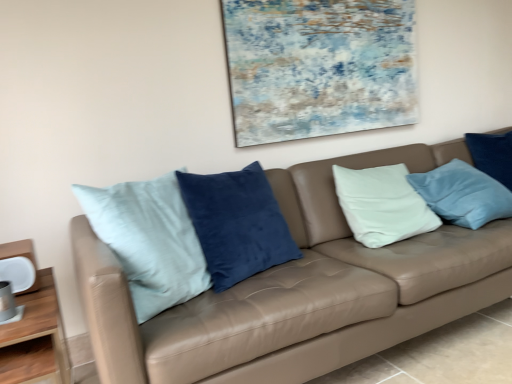
Question: From a real-world perspective, is velvet blue pillow at right located beneath leather couch at center?

Choices:
 (A) yes
 (B) no

Answer: (B)

Question: Considering the relative sizes of velvet blue pillow at right and leather couch at center in the image provided, is velvet blue pillow at right taller than leather couch at center?

Choices:
 (A) yes
 (B) no

Answer: (B)

Question: Is velvet blue pillow at right with leather couch at center?

Choices:
 (A) no
 (B) yes

Answer: (A)

Question: Can you confirm if velvet blue pillow at right is smaller than leather couch at center?

Choices:
 (A) no
 (B) yes

Answer: (B)

Question: Would you say velvet blue pillow at right is outside leather couch at center?

Choices:
 (A) yes
 (B) no

Answer: (B)

Question: Is velvet blue pillow at right looking in the opposite direction of leather couch at center?

Choices:
 (A) yes
 (B) no

Answer: (A)

Question: From a real-world perspective, is leather couch at center positioned under textured canvas painting at upper center based on gravity?

Choices:
 (A) no
 (B) yes

Answer: (B)

Question: Does leather couch at center have a lesser width compared to textured canvas painting at upper center?

Choices:
 (A) no
 (B) yes

Answer: (A)

Question: Is leather couch at center facing away from textured canvas painting at upper center?

Choices:
 (A) yes
 (B) no

Answer: (B)

Question: Is leather couch at center closer to camera compared to textured canvas painting at upper center?

Choices:
 (A) yes
 (B) no

Answer: (A)

Question: Does leather couch at center come behind textured canvas painting at upper center?

Choices:
 (A) no
 (B) yes

Answer: (A)

Question: From the image's perspective, is leather couch at center below textured canvas painting at upper center?

Choices:
 (A) no
 (B) yes

Answer: (B)

Question: Is leather couch at center smaller than wooden table at lower left?

Choices:
 (A) no
 (B) yes

Answer: (A)